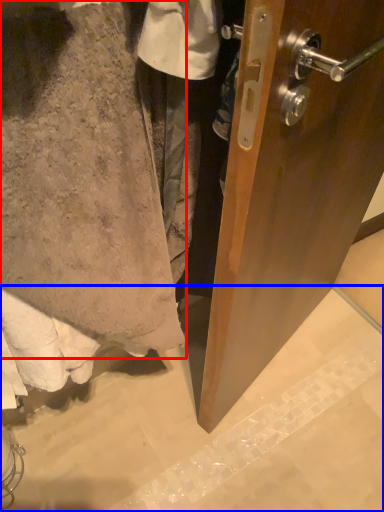
Question: Which point is closer to the camera, towel (highlighted by a red box) or concrete (highlighted by a blue box)?

Choices:
 (A) towel
 (B) concrete

Answer: (A)